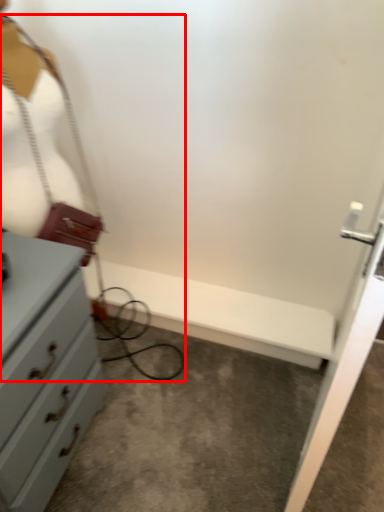
Question: From the image's perspective, considering the relative positions of wire (annotated by the red box) and mannequin in the image provided, where is wire (annotated by the red box) located with respect to the staircase?

Choices:
 (A) below
 (B) above

Answer: (A)